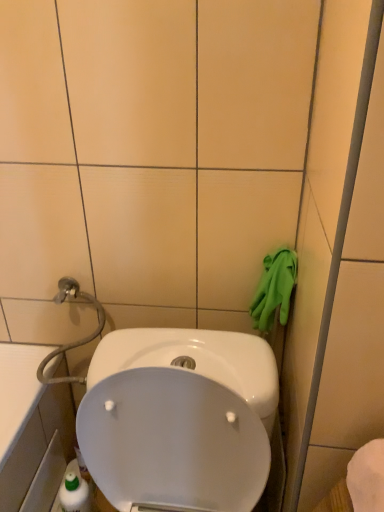
Question: Considering the positions of green rubber gloves at right and green rubber glove at right in the image, is green rubber gloves at right taller or shorter than green rubber glove at right?

Choices:
 (A) short
 (B) tall

Answer: (A)

Question: Considering their positions, is green rubber gloves at right located in front of or behind green rubber glove at right?

Choices:
 (A) front
 (B) behind

Answer: (B)

Question: From the image's perspective, is green rubber gloves at right located above or below green rubber glove at right?

Choices:
 (A) below
 (B) above

Answer: (B)

Question: Is green rubber glove at right inside or outside of green rubber gloves at right?

Choices:
 (A) outside
 (B) inside

Answer: (A)

Question: Considering their positions, is green rubber glove at right located in front of or behind green rubber gloves at right?

Choices:
 (A) behind
 (B) front

Answer: (B)

Question: Considering the positions of point (374, 65) and point (269, 324), is point (374, 65) closer or farther from the camera than point (269, 324)?

Choices:
 (A) farther
 (B) closer

Answer: (B)

Question: Is green rubber glove at right wider or thinner than green rubber gloves at right?

Choices:
 (A) thin
 (B) wide

Answer: (A)